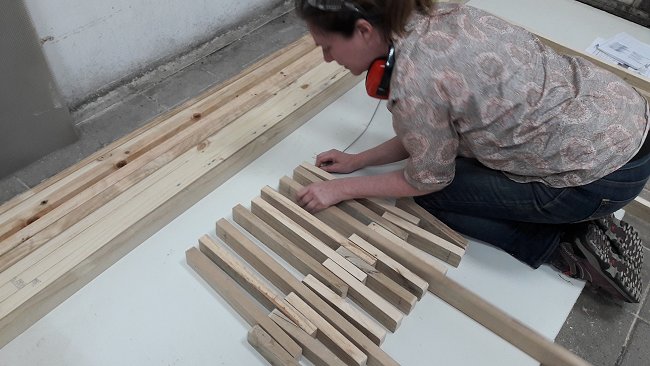
Where is `floor tiles`? The image size is (650, 366). floor tiles is located at coordinates (170, 93), (597, 330).